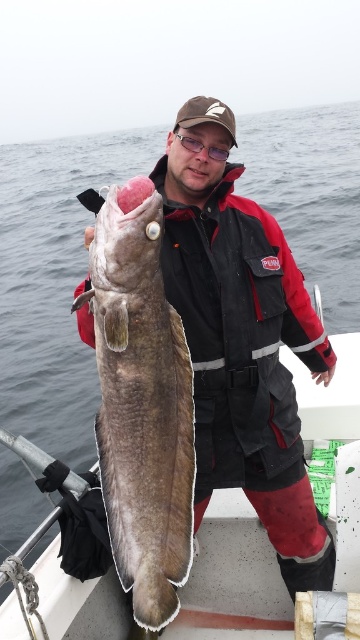
Does dark gray textured fish at center appear on the left side of smooth plastic boat at center?

Indeed, dark gray textured fish at center is positioned on the left side of smooth plastic boat at center.

Can you confirm if dark gray textured fish at center is shorter than smooth plastic boat at center?

No, dark gray textured fish at center is not shorter than smooth plastic boat at center.

Locate an element on the screen. dark gray textured fish at center is located at coordinates (141, 403).

Between black fabric jacket at center and dark gray textured fish at center, which one is positioned lower?

dark gray textured fish at center

The height and width of the screenshot is (640, 360). What are the coordinates of `black fabric jacket at center` in the screenshot? It's located at (241, 339).

Does black fabric jacket at center appear over smooth plastic boat at center?

Indeed, black fabric jacket at center is positioned over smooth plastic boat at center.

Does black fabric jacket at center appear on the left side of smooth plastic boat at center?

Incorrect, black fabric jacket at center is not on the left side of smooth plastic boat at center.

Who is more forward, (190, 244) or (237, 600)?

Point (190, 244)

The width and height of the screenshot is (360, 640). What are the coordinates of `black fabric jacket at center` in the screenshot? It's located at (241, 339).